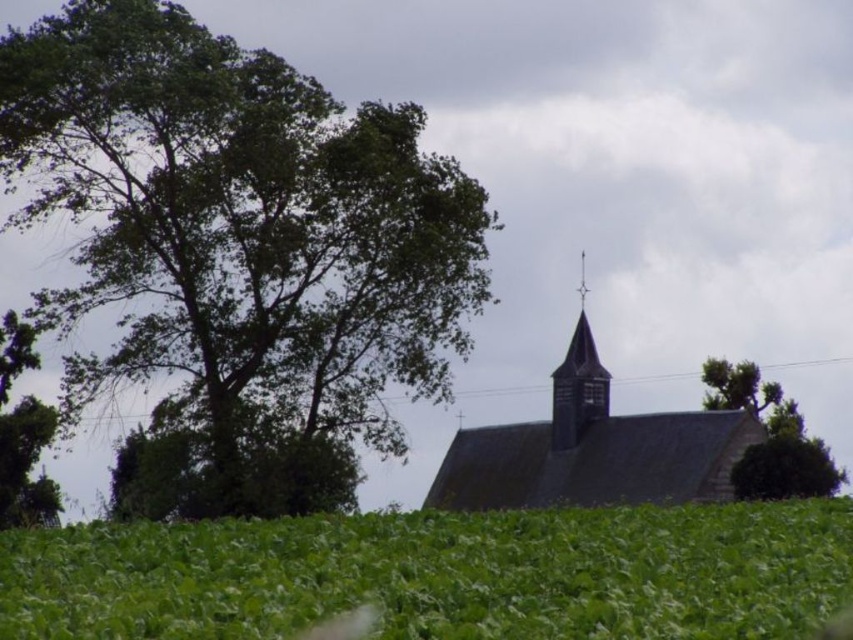
You are standing in the rural area in front of the church and want to take a photo of the church with the green leafy tree at upper left in the background. Where should you position yourself to ensure the tree is fully visible in the frame?

You should position yourself to the right side of the green leafy tree at upper left to ensure it is fully visible in the frame.

You are standing in the field looking towards the church. There are two green leafy trees in the scene. Which tree is positioned to the right when comparing the green leafy tree at upper left and the green leafy tree at left?

The green leafy tree at upper left is positioned to the right of the green leafy tree at left.

You are standing in the rural scene and want to locate the dark gray shingles at center. Based on the coordinates provided in the Objects Description, can you determine their position relative to the church?

The dark gray shingles at center are located at point coordinates (592, 449), which places them near the center of the image, likely on the roof of the church as described in the Scene.